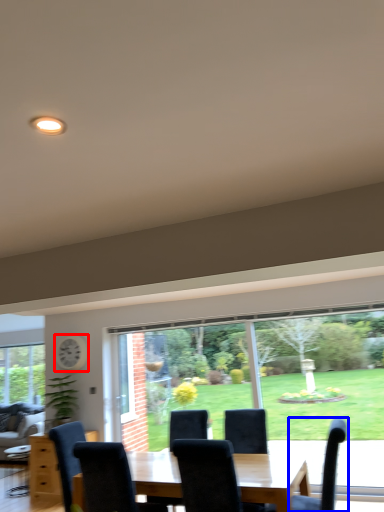
Question: Which point is closer to the camera, clock (highlighted by a red box) or chair (highlighted by a blue box)?

Choices:
 (A) clock
 (B) chair

Answer: (B)